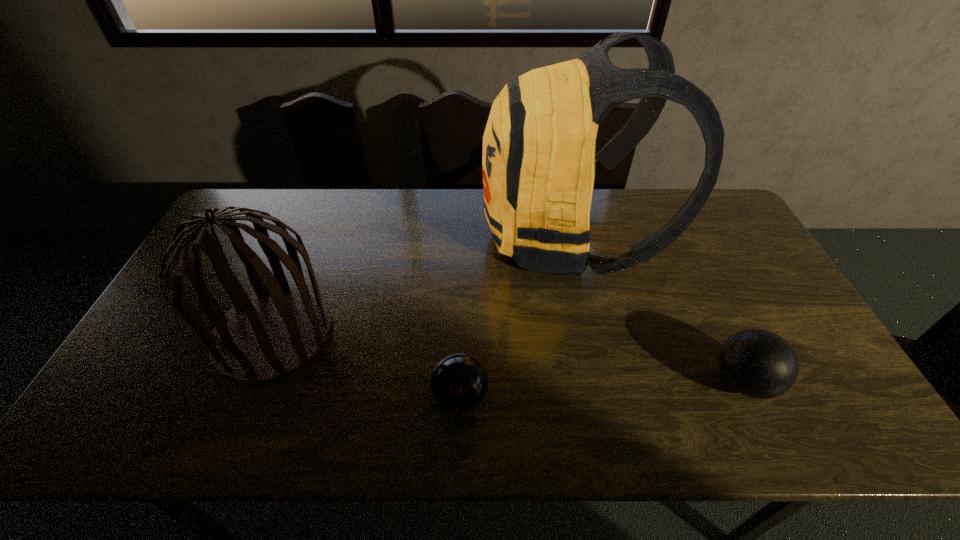
Locate an element on the screen. The height and width of the screenshot is (540, 960). free space between the left bowling ball and the leftmost object is located at coordinates (367, 366).

Point out which object is positioned as the nearest to the shortest object. Please provide its 2D coordinates. Your answer should be formatted as a tuple, i.e. [(x, y)], where the tuple contains the x and y coordinates of a point satisfying the conditions above.

[(538, 164)]

Locate which object ranks second in proximity to the right bowling ball. Please provide its 2D coordinates. Your answer should be formatted as a tuple, i.e. [(x, y)], where the tuple contains the x and y coordinates of a point satisfying the conditions above.

[(459, 382)]

At what (x,y) coordinates should I click in order to perform the action: click on vacant point that satisfies the following two spatial constraints: 1. on the front-facing side of the tallest object; 2. on the front side of the third shortest object. Please return your answer as a coordinate pair (x, y). The image size is (960, 540). Looking at the image, I should click on (587, 334).

Where is `free location that satisfies the following two spatial constraints: 1. on the grip area of the third tallest object; 2. on the surface of the left bowling ball near the finger holes`? free location that satisfies the following two spatial constraints: 1. on the grip area of the third tallest object; 2. on the surface of the left bowling ball near the finger holes is located at coordinates (750, 397).

Locate an element on the screen. This screenshot has height=540, width=960. vacant position in the image that satisfies the following two spatial constraints: 1. on the front-facing side of the tallest object; 2. on the front side of the second tallest object is located at coordinates (587, 334).